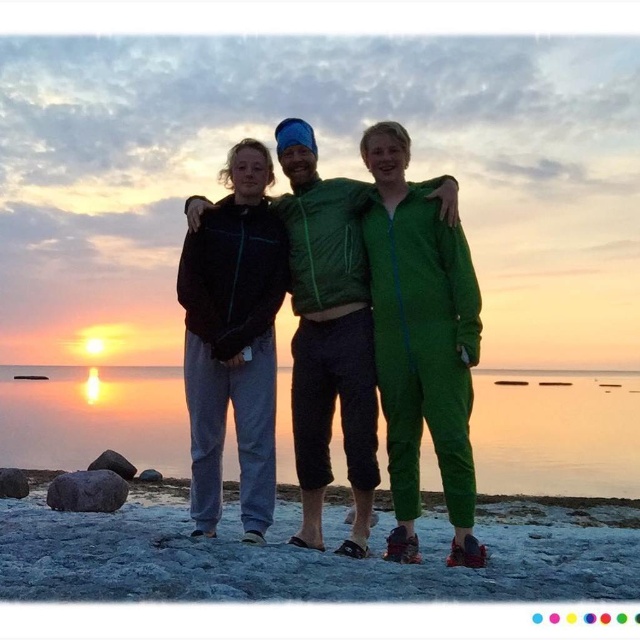
Between green fleece jumpsuit at center and matte black jacket at center, which one appears on the left side from the viewer's perspective?

matte black jacket at center is more to the left.

Between green fleece jumpsuit at center and matte black jacket at center, which one is positioned higher?

matte black jacket at center is above.

Who is more distant from viewer, (470, 522) or (236, 204)?

The point (236, 204) is more distant.

This screenshot has width=640, height=640. What are the coordinates of `green fleece jumpsuit at center` in the screenshot? It's located at (420, 342).

Can you confirm if sandy at center is wider than green fleece jumpsuit at center?

Yes, sandy at center is wider than green fleece jumpsuit at center.

Does sandy at center appear under green fleece jumpsuit at center?

Yes, sandy at center is below green fleece jumpsuit at center.

Between point (144, 566) and point (369, 243), which one is positioned in front?

Point (144, 566) is more forward.

Locate an element on the screen. This screenshot has width=640, height=640. sandy at center is located at coordinates (314, 554).

In order to click on sandy at center in this screenshot , I will do (x=314, y=554).

Measure the distance between sandy at center and camera.

5.29 meters

Where is `sandy at center`? This screenshot has width=640, height=640. sandy at center is located at coordinates (314, 554).